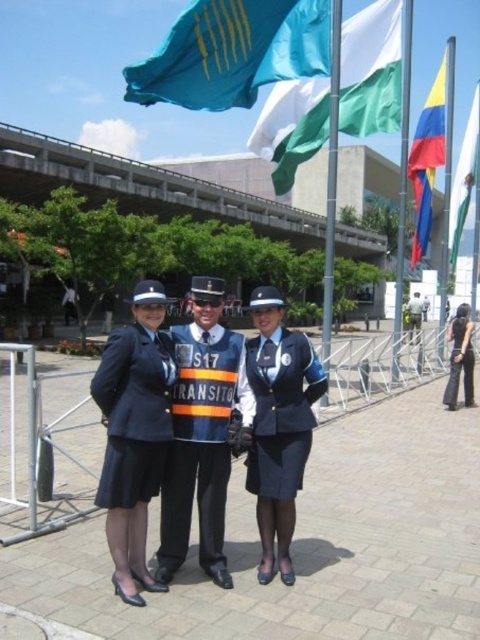
Question: Can you confirm if matte black uniform at center is thinner than green fabric flag at upper right?

Choices:
 (A) yes
 (B) no

Answer: (A)

Question: Among these objects, which one is farthest from the camera?

Choices:
 (A) matte black uniform at center
 (B) black fabric skirt at lower right
 (C) reflective silver vest at center
 (D) teal fabric flag at upper center

Answer: (B)

Question: Does teal fabric flag at upper center appear over white fabric flag at upper center?

Choices:
 (A) yes
 (B) no

Answer: (A)

Question: Which of the following is the closest to the observer?

Choices:
 (A) (464, 189)
 (B) (132, 557)
 (C) (214, 8)

Answer: (B)

Question: Is the position of white fabric flag at upper center less distant than that of dark blue uniform at center?

Choices:
 (A) no
 (B) yes

Answer: (B)

Question: Which object appears farthest from the camera in this image?

Choices:
 (A) matte black uniform at center
 (B) teal fabric flag at upper center
 (C) blue fabric skirt at center

Answer: (B)